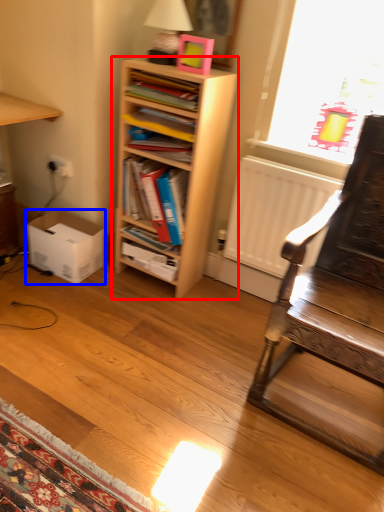
Question: Which of the following is the closest to the observer, shelf (highlighted by a red box) or box (highlighted by a blue box)?

Choices:
 (A) shelf
 (B) box

Answer: (A)